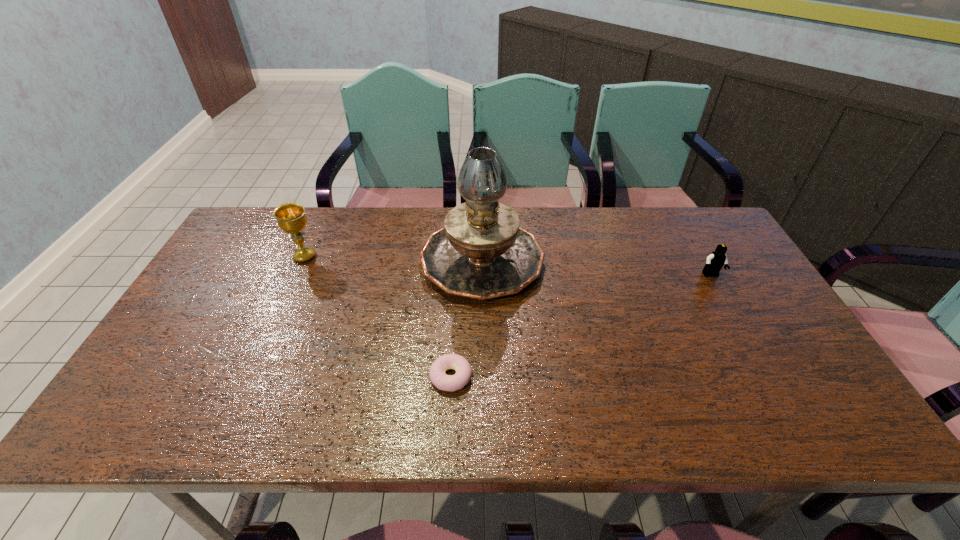
You are a GUI agent. You are given a task and a screenshot of the screen. Output one action in this format:
    pyautogui.click(x=<x>, y=<y>)
    Task: Click on the oil lamp
    Image resolution: width=960 pixels, height=540 pixels.
    Given the screenshot: What is the action you would take?
    pyautogui.click(x=481, y=252)

At what (x,y) coordinates should I click in order to perform the action: click on the second tallest object. Please return your answer as a coordinate pair (x, y). Looking at the image, I should click on (291, 218).

This screenshot has height=540, width=960. In order to click on the leftmost object in this screenshot , I will do click(x=291, y=218).

Where is `the rightmost object`? This screenshot has width=960, height=540. the rightmost object is located at coordinates (715, 261).

The height and width of the screenshot is (540, 960). I want to click on Lego, so click(715, 261).

Locate an element on the screen. The height and width of the screenshot is (540, 960). doughnut is located at coordinates (442, 381).

Where is `the shortest object`? The width and height of the screenshot is (960, 540). the shortest object is located at coordinates (442, 381).

Locate an element on the screen. vacant area situated on the front of the oil lamp is located at coordinates (483, 348).

The height and width of the screenshot is (540, 960). I want to click on free space located on the right of the leftmost object, so click(x=413, y=256).

This screenshot has width=960, height=540. I want to click on vacant region located on the front-facing side of the rightmost object, so click(782, 403).